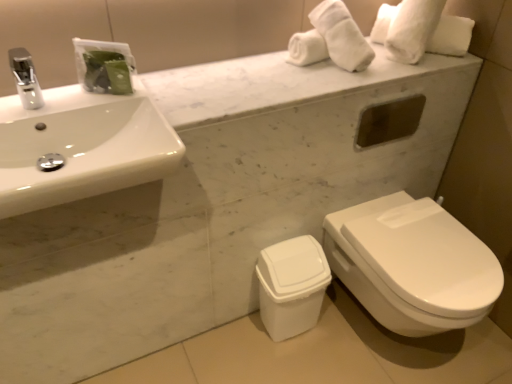
Where is `vacant space to the left of white plastic trash can at lower center`? This screenshot has height=384, width=512. vacant space to the left of white plastic trash can at lower center is located at coordinates (230, 339).